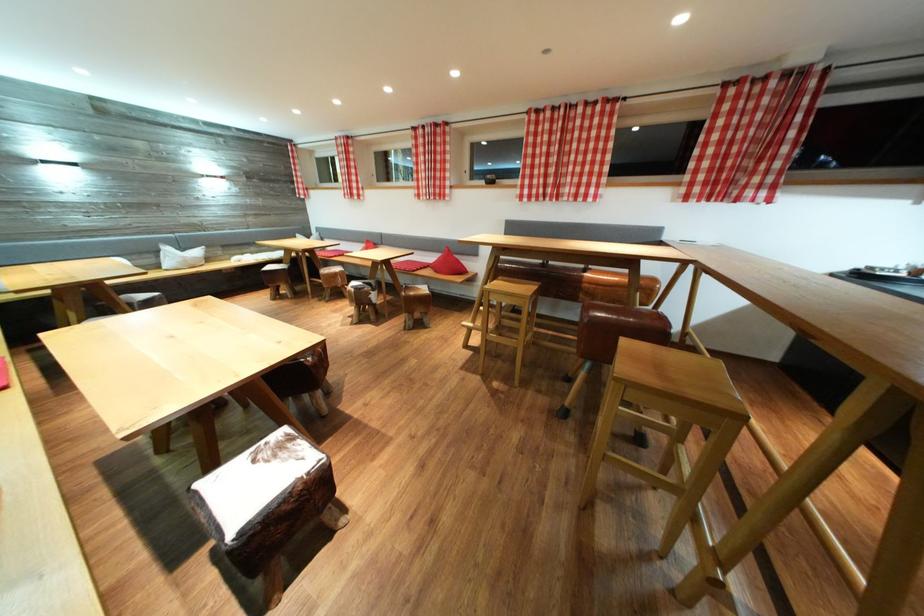
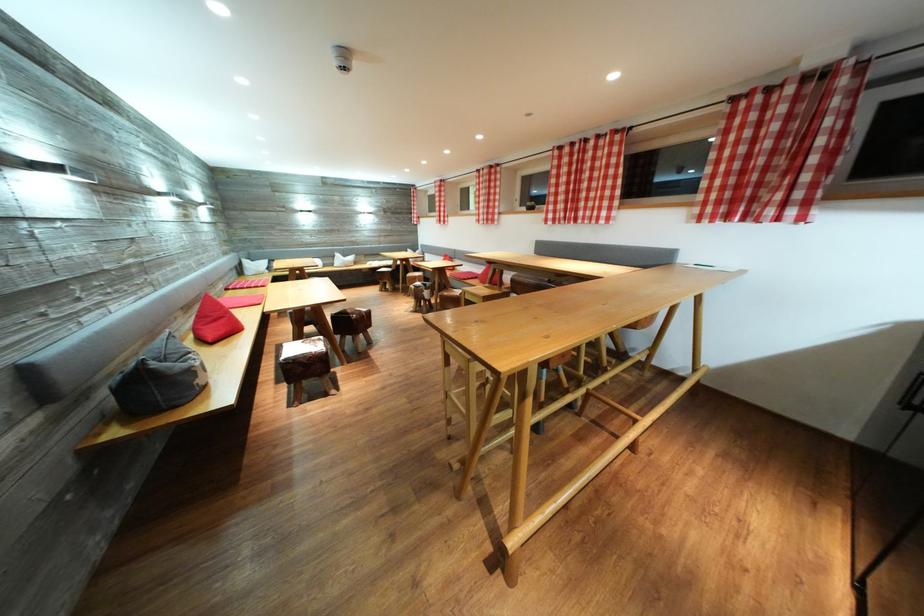
Find the pixel in the second image that matches the point at 286,452 in the first image.

(321, 346)